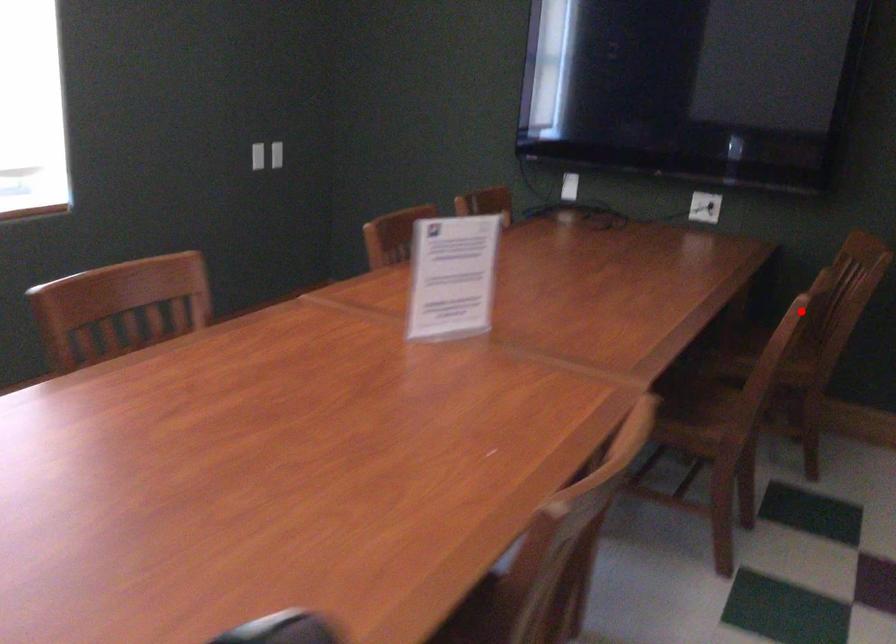
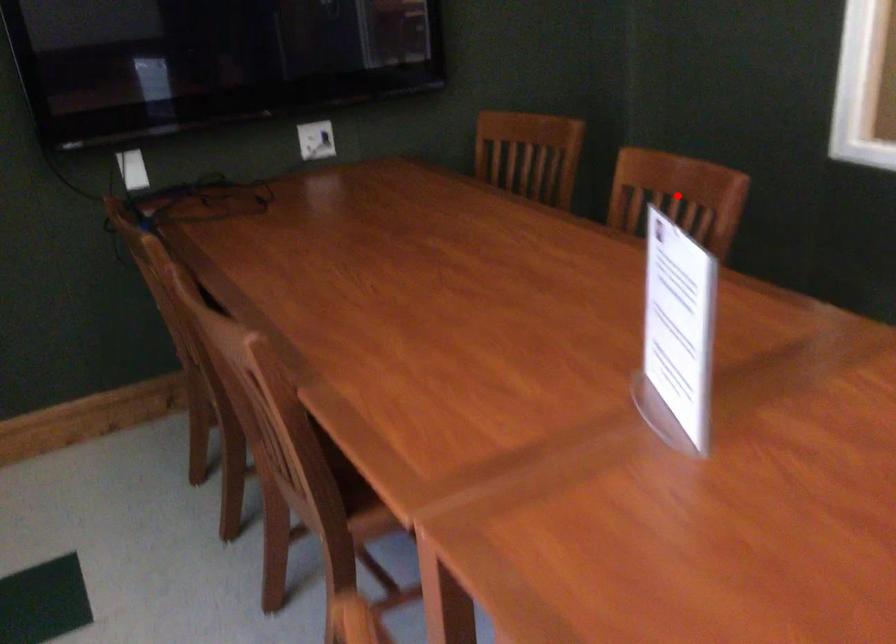
I am providing you with two images of the same scene from different viewpoints. A red point is marked on the first image and another point is marked on the second image. Are the points marked in image1 and image2 representing the same 3D position?

Yes